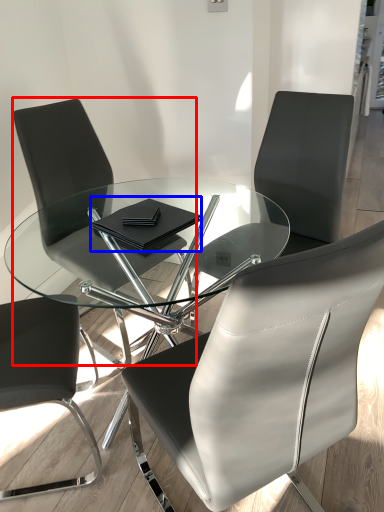
Question: Which object is further to the camera taking this photo, chair (highlighted by a red box) or notebook (highlighted by a blue box)?

Choices:
 (A) chair
 (B) notebook

Answer: (A)